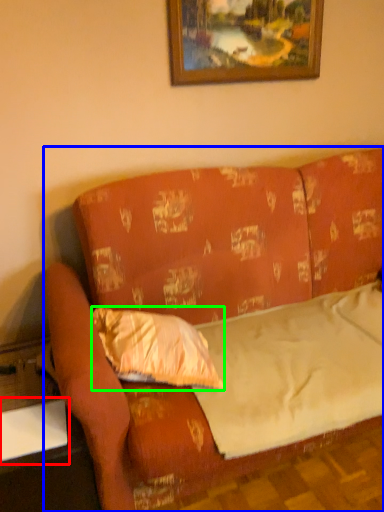
Question: Which object is the closest to the table (highlighted by a red box)? Choose among these: studio couch (highlighted by a blue box) or pillow (highlighted by a green box).

Choices:
 (A) studio couch
 (B) pillow

Answer: (B)